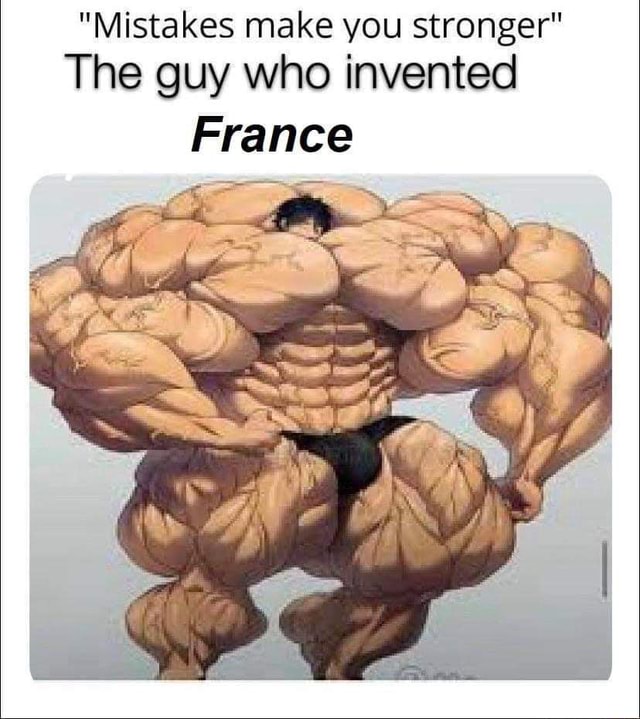
Identify the location of chest. The height and width of the screenshot is (719, 640). [290, 283], [400, 274].